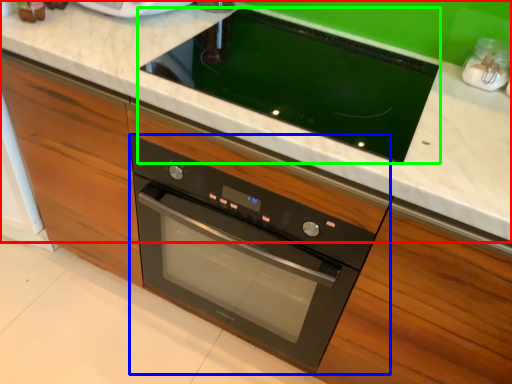
Question: Which object is the farthest from countertop (highlighted by a red box)? Choose among these: oven (highlighted by a blue box) or home appliance (highlighted by a green box).

Choices:
 (A) oven
 (B) home appliance

Answer: (A)